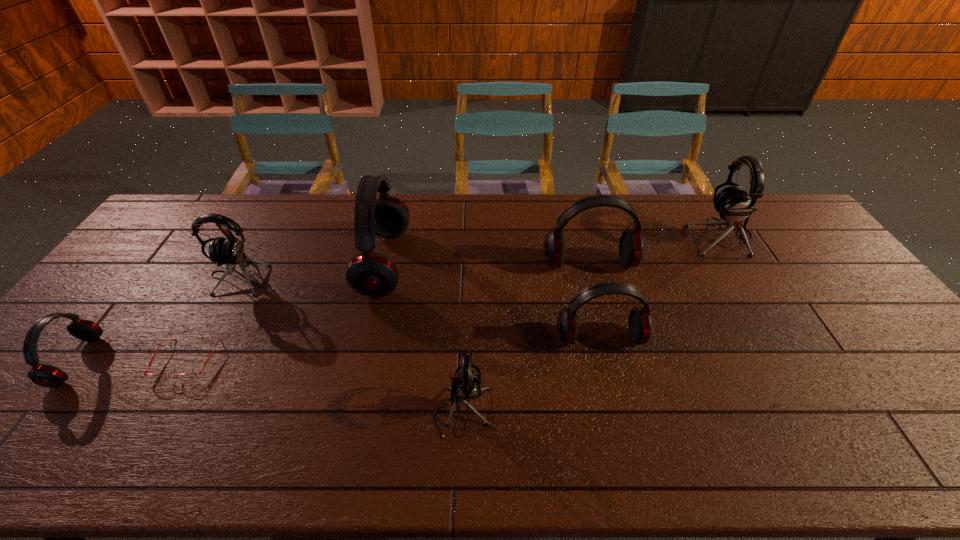
Locate an element on the screen. the rightmost black earphone is located at coordinates (733, 203).

Where is `the rightmost object`? the rightmost object is located at coordinates (733, 203).

Locate an element on the screen. The image size is (960, 540). the biggest red earphone is located at coordinates (369, 273).

Where is `the fifth earphone from right to left`? This screenshot has width=960, height=540. the fifth earphone from right to left is located at coordinates (369, 273).

Where is `the third smallest red earphone`? The height and width of the screenshot is (540, 960). the third smallest red earphone is located at coordinates (631, 248).

Find the location of a particular element. The width and height of the screenshot is (960, 540). the sixth earphone from right to left is located at coordinates (230, 250).

This screenshot has height=540, width=960. I want to click on the second smallest black earphone, so click(230, 250).

The width and height of the screenshot is (960, 540). Identify the location of the second smallest red earphone. (640, 325).

This screenshot has width=960, height=540. I want to click on the second black earphone from left to right, so click(465, 387).

Where is `the fourth earphone from left to right`? This screenshot has height=540, width=960. the fourth earphone from left to right is located at coordinates (465, 387).